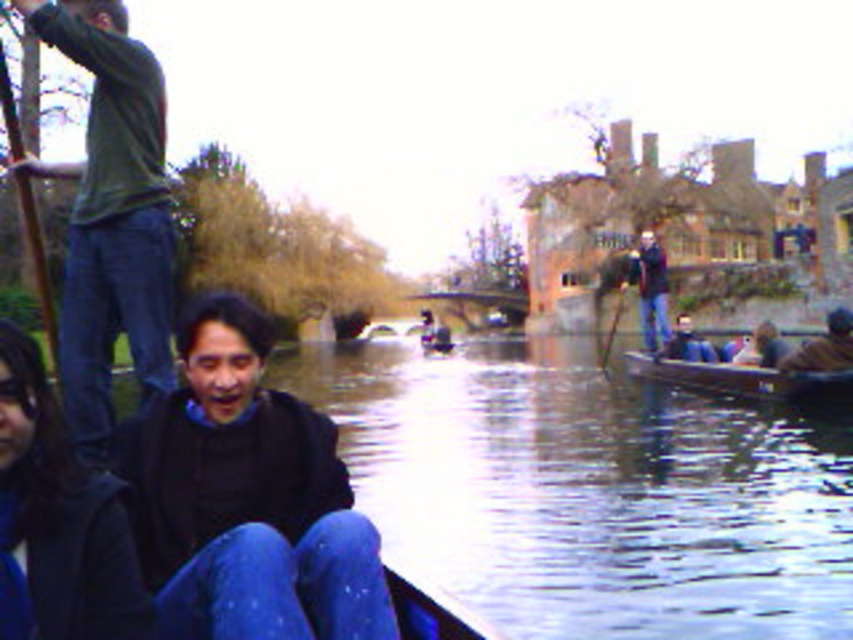
You are a fashion designer observing the scene. You need to determine which item of clothing has a bigger size between the dark blue jeans at center and the dark brown leather jacket at lower right. Which one should you choose to focus on for a larger size design?

The dark blue jeans at center has a larger size compared to the dark brown leather jacket at lower right, so you should focus on the dark blue jeans at center for a larger size design.

You are a photographer taking a picture of the scene. You notice two pairs of jeans in the image. Which pair of jeans is closer to the camera, the blue denim jeans at lower center or the dark blue jeans at center?

The blue denim jeans at lower center is closer to the camera because it is in front of the dark blue jeans at center according to the description.

You are a photographer trying to capture a clear shot of the green cotton shirt at upper left and dark brown leather jacket at lower right. Since you want both subjects to be in focus, which one should you focus on first to ensure the other is also sharp?

The green cotton shirt at upper left is positioned over the dark brown leather jacket at lower right, so focusing on the green cotton shirt at upper left first will ensure the dark brown leather jacket at lower right is also in focus due to their overlapping positions.